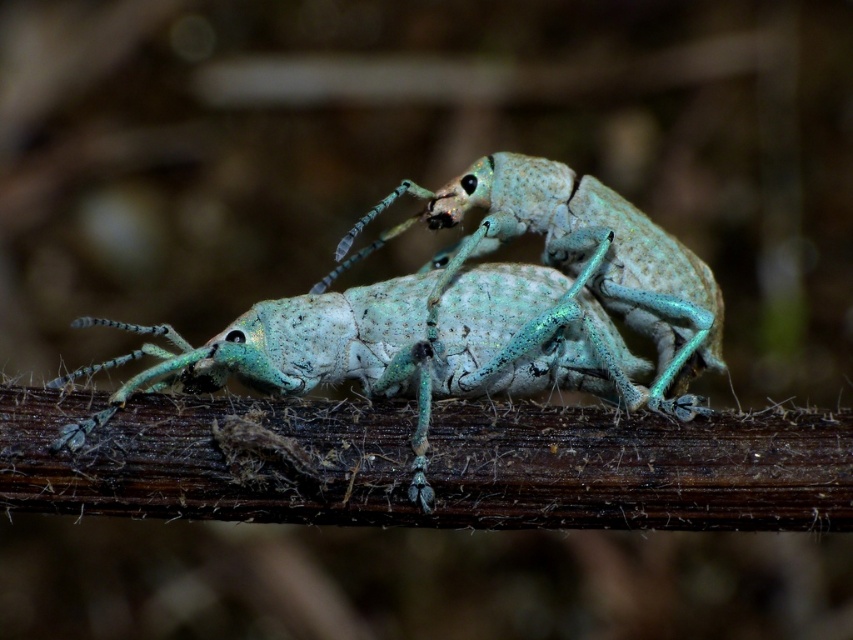
Question: Which of the following is the farthest from the observer?

Choices:
 (A) (540, 388)
 (B) (492, 228)

Answer: (B)

Question: Which of the following is the closest to the observer?

Choices:
 (A) (697, 400)
 (B) (689, 298)

Answer: (A)

Question: Which point is farther to the camera?

Choices:
 (A) speckled light blue beetle at center
 (B) matte green insect at center

Answer: (A)

Question: Does matte green insect at center appear on the right side of speckled light blue beetle at center?

Choices:
 (A) no
 (B) yes

Answer: (A)

Question: Is matte green insect at center in front of speckled light blue beetle at center?

Choices:
 (A) no
 (B) yes

Answer: (B)

Question: Can you confirm if matte green insect at center is positioned above speckled light blue beetle at center?

Choices:
 (A) no
 (B) yes

Answer: (A)